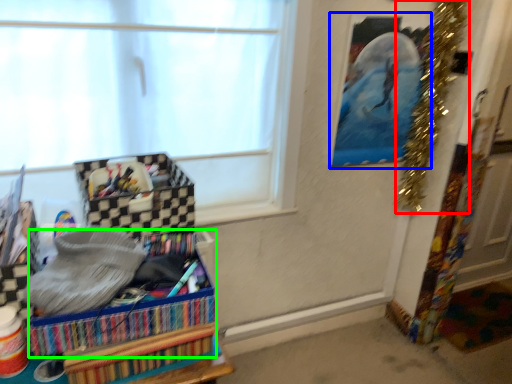
Question: Considering the real-world distances, which object is closest to christmas decoration (highlighted by a red box)? picture frame (highlighted by a blue box) or storage box (highlighted by a green box).

Choices:
 (A) picture frame
 (B) storage box

Answer: (A)